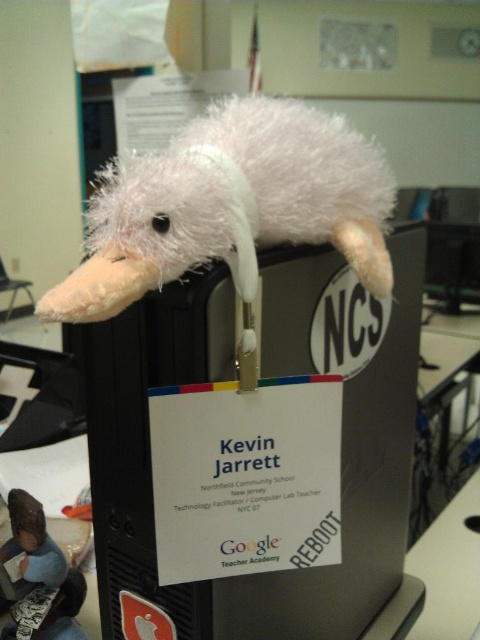
Does white fluffy kiwi at upper center have a lesser height compared to fluffy white plush toy at upper center?

In fact, white fluffy kiwi at upper center may be taller than fluffy white plush toy at upper center.

Can you confirm if white fluffy kiwi at upper center is positioned above fluffy white plush toy at upper center?

Correct, white fluffy kiwi at upper center is located above fluffy white plush toy at upper center.

Is point (289, 147) less distant than point (20, 524)?

Yes, it is in front of point (20, 524).

The width and height of the screenshot is (480, 640). What are the coordinates of `white fluffy kiwi at upper center` in the screenshot? It's located at (230, 205).

Who is shorter, black matte computer at center or fluffy white plush toy at upper center?

fluffy white plush toy at upper center

Does black matte computer at center appear on the right side of fluffy white plush toy at upper center?

Yes, black matte computer at center is to the right of fluffy white plush toy at upper center.

Is point (248, 621) positioned before point (54, 564)?

Yes, it is in front of point (54, 564).

Where is `black matte computer at center`? black matte computer at center is located at coordinates (269, 378).

Who is positioned more to the right, black matte computer at center or white fluffy kiwi at upper center?

black matte computer at center is more to the right.

Is black matte computer at center positioned at the back of white fluffy kiwi at upper center?

Yes, black matte computer at center is behind white fluffy kiwi at upper center.

Is point (149, 387) less distant than point (313, 122)?

That is True.

The image size is (480, 640). In order to click on black matte computer at center in this screenshot , I will do `click(269, 378)`.